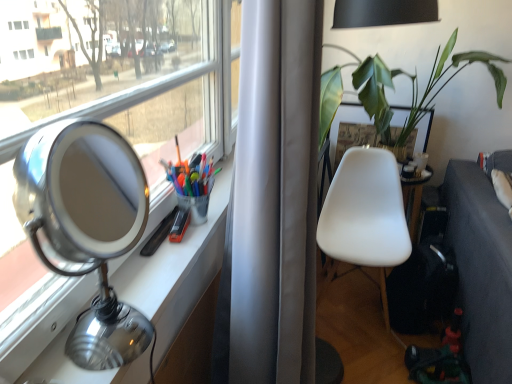
Question: Is white matte chair at center wider or thinner than dark gray fabric couch at lower right?

Choices:
 (A) thin
 (B) wide

Answer: (A)

Question: From the image's perspective, is white matte chair at center located above or below dark gray fabric couch at lower right?

Choices:
 (A) above
 (B) below

Answer: (A)

Question: Estimate the real-world distances between objects in this image. Which object is farther from the green leafy plant at upper right?

Choices:
 (A) dark gray fabric couch at lower right
 (B) white matte chair at center
 (C) polished silver table lamp at left

Answer: (C)

Question: Which object is positioned farthest from the polished silver table lamp at left?

Choices:
 (A) white matte chair at center
 (B) green leafy plant at upper right
 (C) dark gray fabric couch at lower right

Answer: (B)